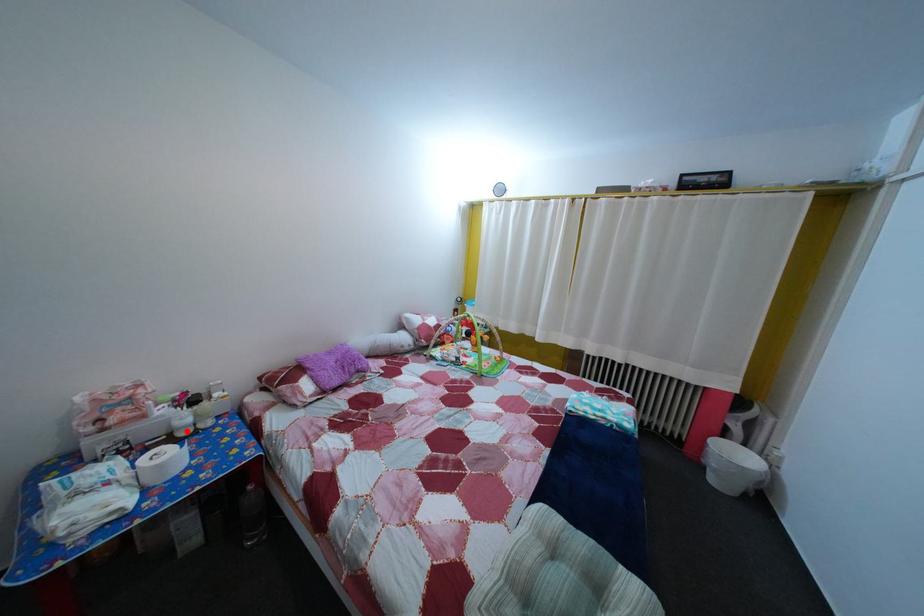
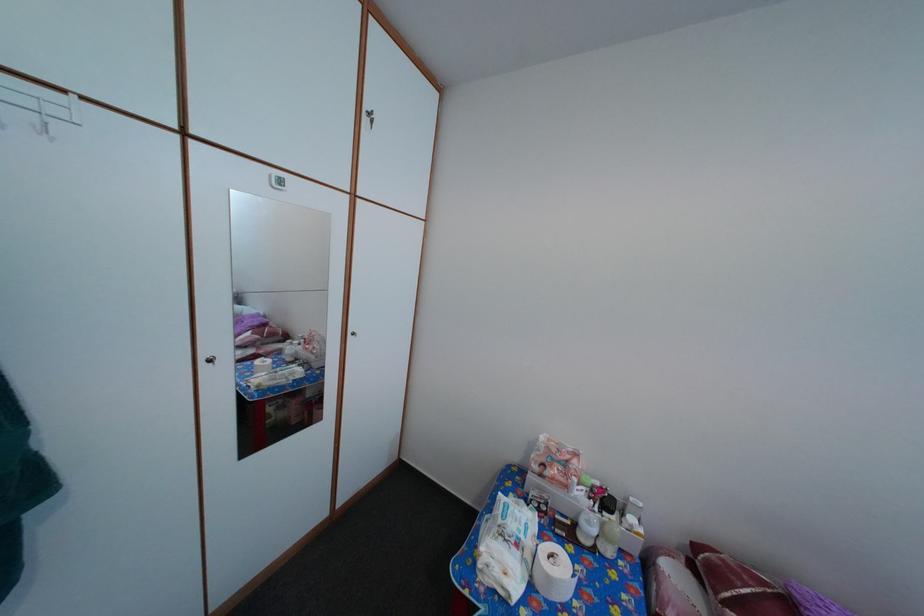
The point at the highlighted location is marked in the first image. Where is the corresponding point in the second image?

(592, 531)